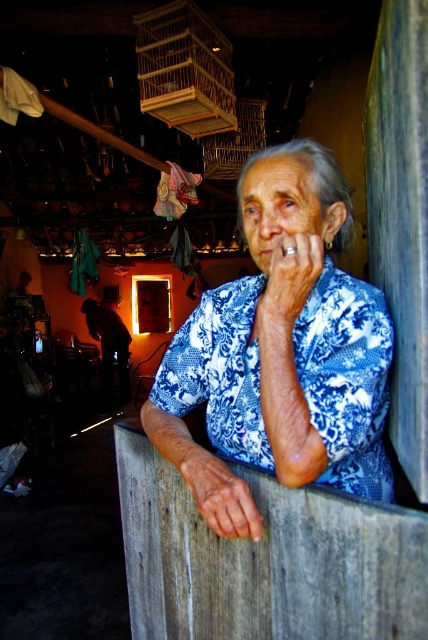
Question: Is blue fabric hand at center bigger than matte blue fabric at center?

Choices:
 (A) no
 (B) yes

Answer: (B)

Question: Is blue fabric hand at center positioned in front of matte blue fabric at center?

Choices:
 (A) no
 (B) yes

Answer: (B)

Question: Is blue fabric hand at center wider than matte blue fabric at center?

Choices:
 (A) yes
 (B) no

Answer: (A)

Question: Which point appears closest to the camera in this image?

Choices:
 (A) (306, 276)
 (B) (267, 189)

Answer: (A)

Question: Estimate the real-world distances between objects in this image. Which object is closer to the blue printed shirt at center?

Choices:
 (A) blue fabric hand at center
 (B) matte blue fabric at center

Answer: (B)

Question: Considering the real-world distances, which object is closest to the blue fabric hand at center?

Choices:
 (A) blue printed shirt at center
 (B) matte blue fabric at center

Answer: (A)